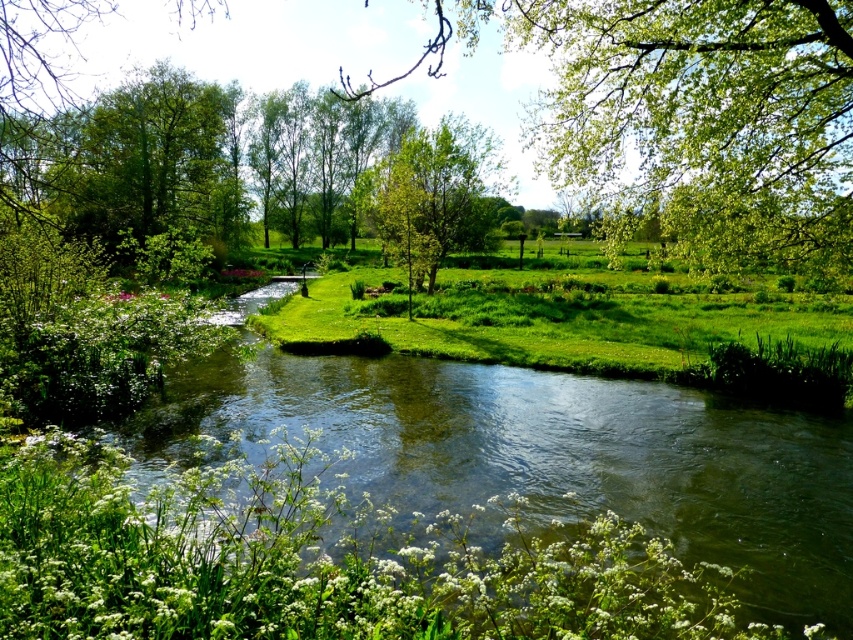
You are standing on the riverbank and see the green grass at center and the green leafy tree at upper left. Which object is located to the right of the other?

The green grass at center is positioned on the right side of green leafy tree at upper left.

You are a hiker standing on the riverbank and want to cross the river. You see the green grass at center and the green leafy tree at upper left. Which object is wider in terms of their horizontal spread?

The green grass at center has a larger width than the green leafy tree at upper left, so the green grass at center is wider in terms of their horizontal spread.

You are planning to set up a picnic area and want to choose between the green leafy tree at upper right and the green leafy tree at center for shade. Based on their sizes, which tree would provide more coverage?

The green leafy tree at upper right might be wider than the green leafy tree at center, so it would likely provide more shade coverage.